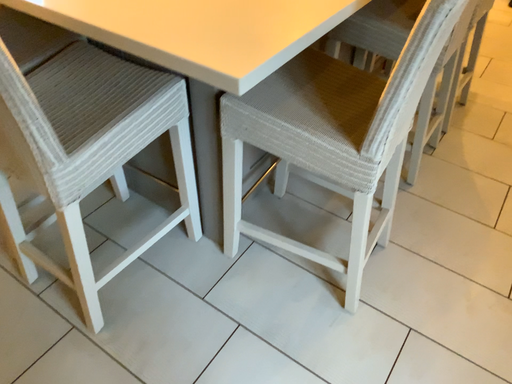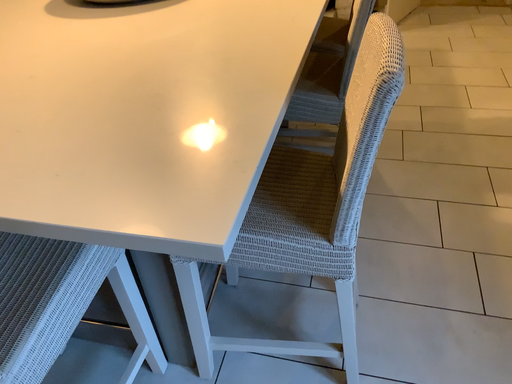
Question: Which way did the camera rotate in the video?

Choices:
 (A) rotated right
 (B) rotated left

Answer: (A)